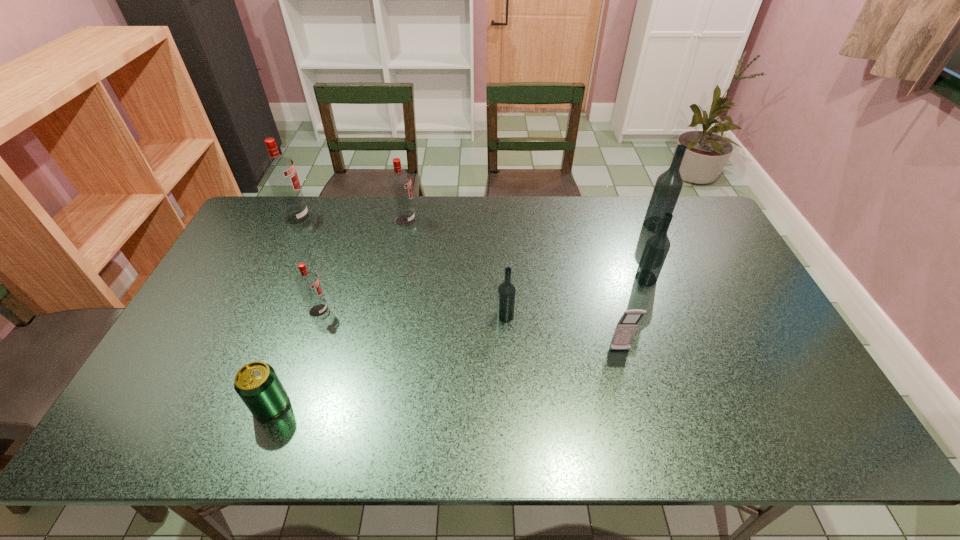
The image size is (960, 540). What are the coordinates of `the leftmost object` in the screenshot? It's located at (280, 171).

Where is `the biggest red vodka`? The height and width of the screenshot is (540, 960). the biggest red vodka is located at coordinates (280, 171).

At what (x,y) coordinates should I click in order to perform the action: click on the rightmost black vodka. Please return your answer as a coordinate pair (x, y). Image resolution: width=960 pixels, height=540 pixels. Looking at the image, I should click on (668, 186).

In order to click on the farthest black vodka in this screenshot , I will do `click(668, 186)`.

The image size is (960, 540). I want to click on the fourth vodka from right to left, so click(399, 182).

Identify the location of the second smallest red vodka. (399, 182).

Image resolution: width=960 pixels, height=540 pixels. I want to click on the second biggest black vodka, so click(x=657, y=246).

The height and width of the screenshot is (540, 960). Find the location of `the second object from right to left`. the second object from right to left is located at coordinates (657, 246).

The image size is (960, 540). In order to click on the smallest red vodka in this screenshot , I will do `click(308, 283)`.

You are a GUI agent. You are given a task and a screenshot of the screen. Output one action in this format:
    pyautogui.click(x=<x>, y=<y>)
    Task: Click on the nearest red vodka
    The width and height of the screenshot is (960, 540).
    Given the screenshot: What is the action you would take?
    pyautogui.click(x=308, y=283)